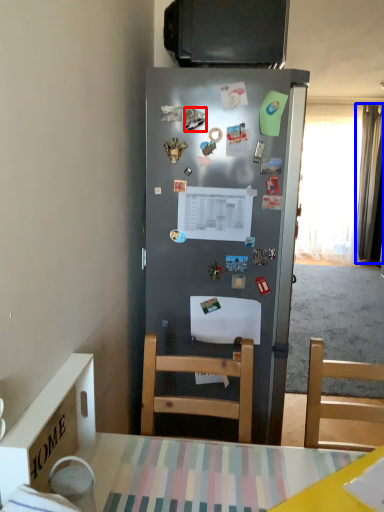
Question: Which object is further to the camera taking this photo, magnet (highlighted by a red box) or curtain (highlighted by a blue box)?

Choices:
 (A) magnet
 (B) curtain

Answer: (B)